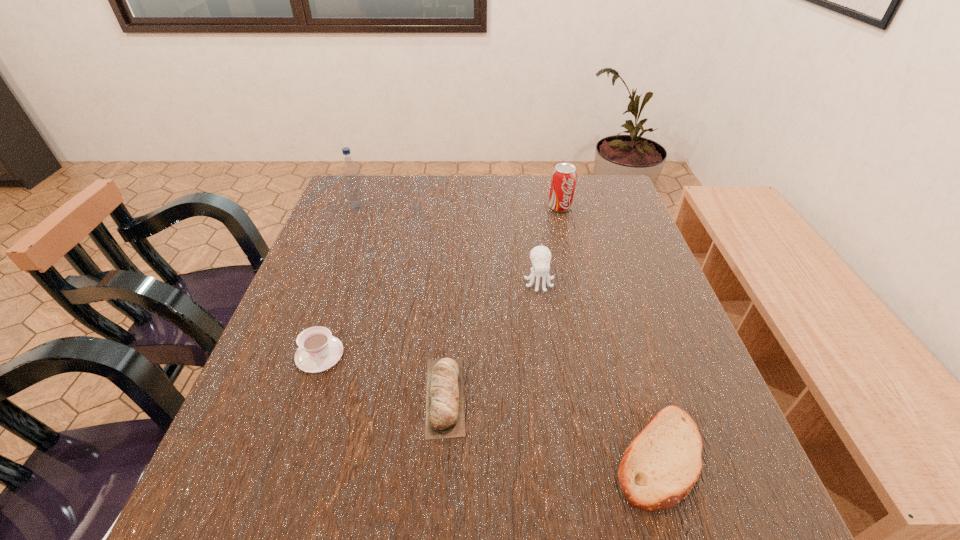
In order to click on the tallest object in this screenshot , I will do `click(350, 171)`.

In order to click on the second tallest object in this screenshot , I will do `click(564, 176)`.

The image size is (960, 540). Find the location of `the third tallest object`. the third tallest object is located at coordinates (540, 256).

This screenshot has height=540, width=960. In order to click on octopus in this screenshot , I will do `click(540, 256)`.

The image size is (960, 540). Find the location of `teacup`. teacup is located at coordinates (318, 351).

Find the location of a particular element. The width and height of the screenshot is (960, 540). the fifth tallest object is located at coordinates (445, 417).

Find the location of `the taller pita bread`. the taller pita bread is located at coordinates (445, 417).

This screenshot has width=960, height=540. What are the coordinates of `the right pita bread` in the screenshot? It's located at (660, 467).

Find the location of a particular element. the shortest object is located at coordinates (660, 467).

This screenshot has width=960, height=540. Find the location of `vacant area situated 0.200m on the front of the tallest object`. vacant area situated 0.200m on the front of the tallest object is located at coordinates (340, 256).